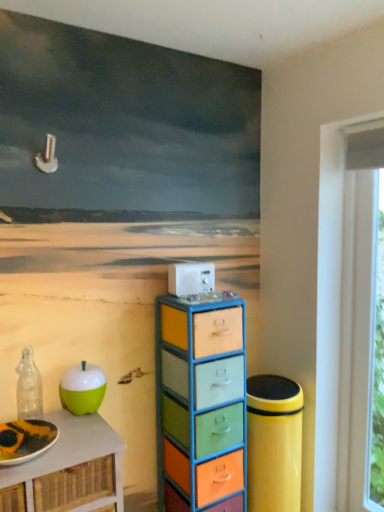
Question: Is green matte apple at left wider than white plastic appliance at center?

Choices:
 (A) yes
 (B) no

Answer: (A)

Question: Is green matte apple at left to the left of white plastic appliance at center from the viewer's perspective?

Choices:
 (A) no
 (B) yes

Answer: (B)

Question: Is green matte apple at left positioned far away from white plastic appliance at center?

Choices:
 (A) no
 (B) yes

Answer: (A)

Question: Considering the relative sizes of green matte apple at left and white plastic appliance at center in the image provided, is green matte apple at left thinner than white plastic appliance at center?

Choices:
 (A) no
 (B) yes

Answer: (A)

Question: Is the depth of green matte apple at left less than that of white plastic appliance at center?

Choices:
 (A) no
 (B) yes

Answer: (B)

Question: Choose the correct answer: Is green matte apple at lower left inside transparent glass bottle at left or outside it?

Choices:
 (A) outside
 (B) inside

Answer: (A)

Question: In terms of height, does green matte apple at lower left look taller or shorter compared to transparent glass bottle at left?

Choices:
 (A) tall
 (B) short

Answer: (B)

Question: Looking at their shapes, would you say green matte apple at lower left is wider or thinner than transparent glass bottle at left?

Choices:
 (A) wide
 (B) thin

Answer: (A)

Question: Is point (89, 409) closer or farther from the camera than point (24, 380)?

Choices:
 (A) closer
 (B) farther

Answer: (A)

Question: From the image's perspective, is matte white plate at lower left located above or below green matte apple at lower left?

Choices:
 (A) below
 (B) above

Answer: (A)

Question: Looking at their shapes, would you say matte white plate at lower left is wider or thinner than green matte apple at lower left?

Choices:
 (A) thin
 (B) wide

Answer: (B)

Question: From a real-world perspective, is matte white plate at lower left above or below green matte apple at lower left?

Choices:
 (A) above
 (B) below

Answer: (B)

Question: In the image, is matte white plate at lower left on the left side or the right side of green matte apple at lower left?

Choices:
 (A) left
 (B) right

Answer: (A)

Question: Is point (74, 414) closer or farther from the camera than point (49, 422)?

Choices:
 (A) farther
 (B) closer

Answer: (A)

Question: Relative to matte white plate at lower left, is green matte apple at lower left in front or behind?

Choices:
 (A) behind
 (B) front

Answer: (A)